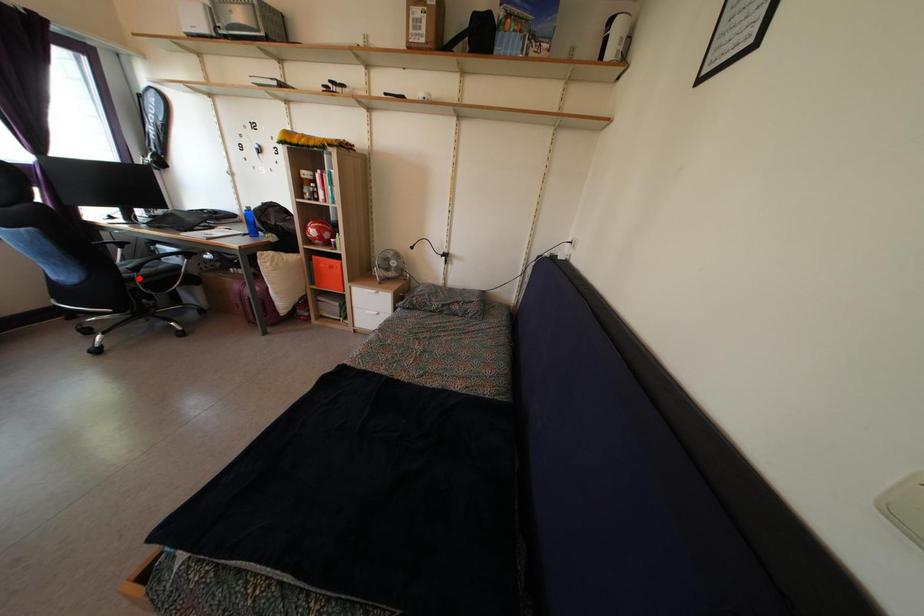
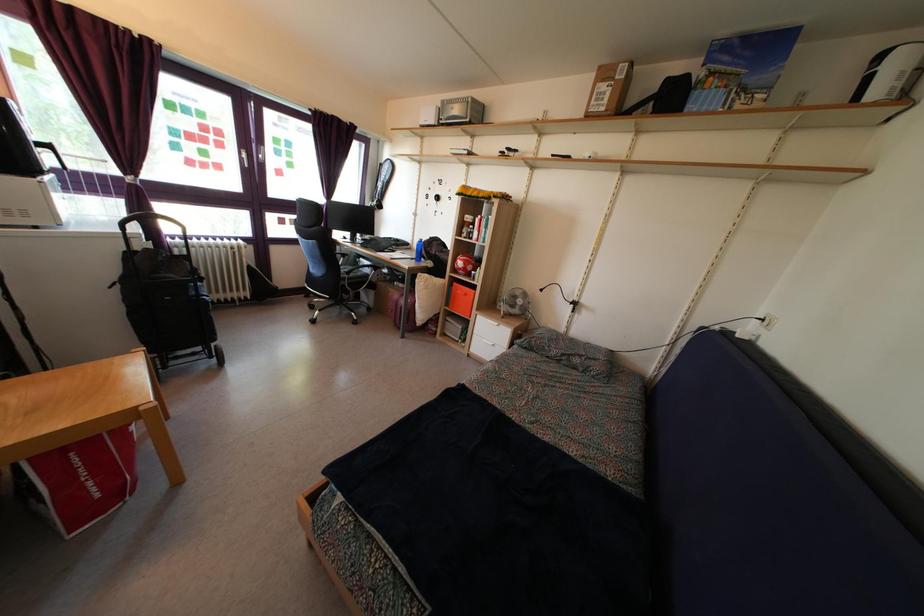
In the second image, find the point that corresponds to the highlighted location in the first image.

(350, 282)